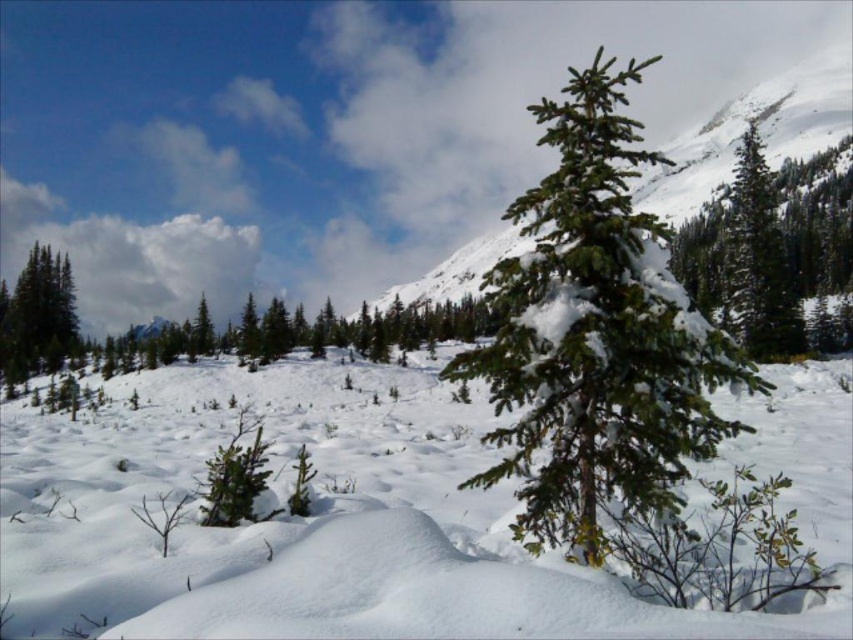
Question: Which point is farther from the camera taking this photo?

Choices:
 (A) (16, 342)
 (B) (374, 387)
 (C) (590, 388)
 (D) (831, 285)

Answer: (D)

Question: Which of the following is the closest to the observer?

Choices:
 (A) green matte evergreen tree at left
 (B) green needle-like tree at upper right

Answer: (B)

Question: Is the position of white fluffy snow at center less distant than that of green matte evergreen tree at left?

Choices:
 (A) no
 (B) yes

Answer: (B)

Question: Can you confirm if white fluffy snow at center is bigger than green matte evergreen tree at left?

Choices:
 (A) no
 (B) yes

Answer: (A)

Question: In this image, where is green needle-like tree at center located relative to green needle-like tree at upper right?

Choices:
 (A) right
 (B) left

Answer: (B)

Question: Among these objects, which one is nearest to the camera?

Choices:
 (A) green matte evergreen tree at left
 (B) white fluffy snow at center

Answer: (B)